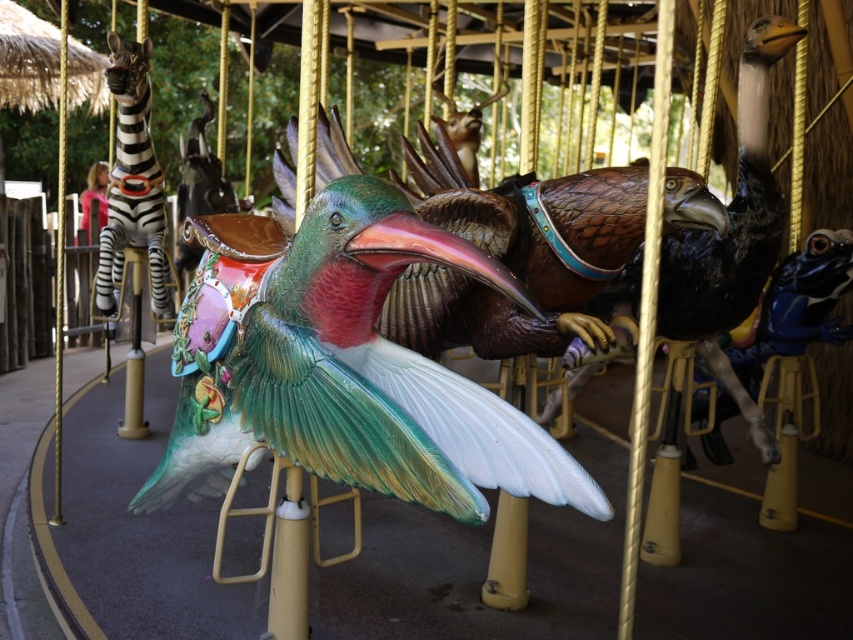
Question: Which point appears closest to the camera in this image?

Choices:
 (A) (740, 202)
 (B) (132, 236)

Answer: (A)

Question: Is shiny brown feathers at center thinner than shiny metallic zebra at left?

Choices:
 (A) no
 (B) yes

Answer: (A)

Question: Which point is farther to the camera?

Choices:
 (A) (157, 252)
 (B) (767, 426)
 (C) (357, 321)

Answer: (A)

Question: Does shiny brown feathers at center lie behind shiny metallic zebra at left?

Choices:
 (A) no
 (B) yes

Answer: (A)

Question: Considering the real-world distances, which object is farthest from the shiny brown feathers at center?

Choices:
 (A) shiny metallic zebra at left
 (B) shiny green and white bird at center

Answer: (A)

Question: Is shiny green and white bird at center positioned at the back of shiny brown feathers at center?

Choices:
 (A) no
 (B) yes

Answer: (A)